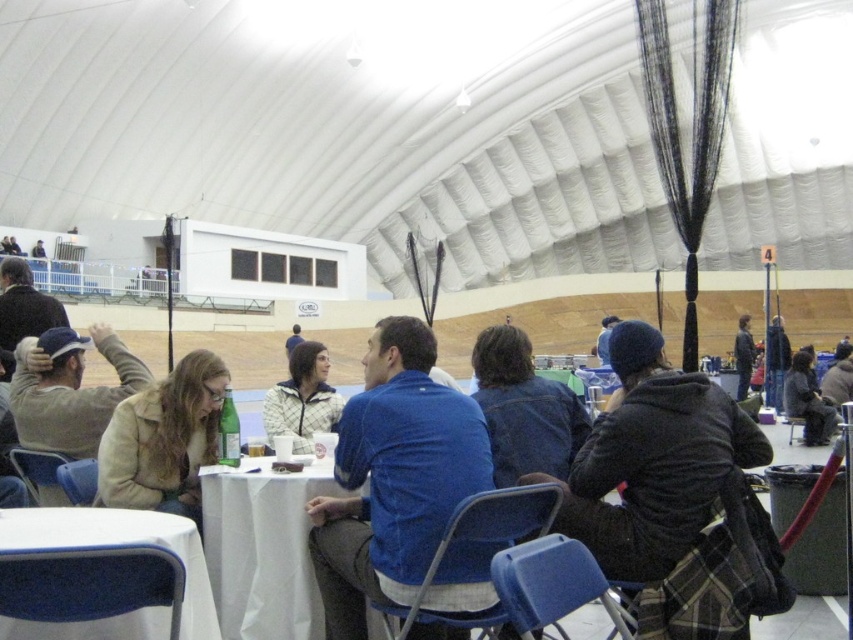
In the scene shown: Is white cloth table at center below dark blue jacket at center?

Correct, white cloth table at center is located below dark blue jacket at center.

Does white cloth table at center have a greater width compared to dark blue jacket at center?

No, white cloth table at center is not wider than dark blue jacket at center.

Who is more distant from viewer, (265, 481) or (741, 356)?

Positioned behind is point (741, 356).

What are the coordinates of `white cloth table at center` in the screenshot? It's located at (263, 547).

Between beige woolen jacket at center and denim jacket at center, which one is positioned higher?

Positioned higher is denim jacket at center.

Is point (144, 445) farther from viewer compared to point (537, 452)?

Yes, it is.

Identify the location of beige woolen jacket at center. (164, 440).

Does point (498, 360) come behind point (288, 417)?

No.

How distant is denim jacket at center from white quilted jacket at center?

denim jacket at center and white quilted jacket at center are 8.69 feet apart from each other.

Is point (540, 449) positioned in front of point (311, 420)?

Yes, point (540, 449) is closer to viewer.

The image size is (853, 640). In order to click on denim jacket at center in this screenshot , I will do `click(524, 408)`.